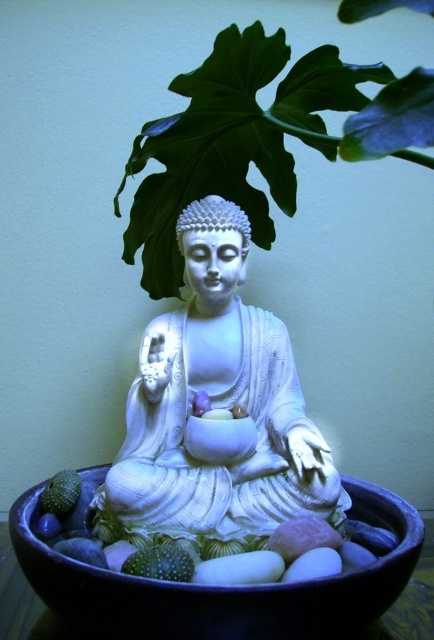
Does black ceramic bowl at center appear on the left side of green speckled fruit at lower center?

In fact, black ceramic bowl at center is to the right of green speckled fruit at lower center.

Looking at this image, is black ceramic bowl at center above green speckled fruit at lower center?

No.

Image resolution: width=434 pixels, height=640 pixels. I want to click on black ceramic bowl at center, so click(222, 588).

Is point (122, 564) less distant than point (66, 477)?

Yes, point (122, 564) is closer to viewer.

Can you confirm if green speckled fruit at lower center is positioned to the right of green matte avocado at lower left?

Indeed, green speckled fruit at lower center is positioned on the right side of green matte avocado at lower left.

This screenshot has height=640, width=434. What do you see at coordinates (161, 563) in the screenshot?
I see `green speckled fruit at lower center` at bounding box center [161, 563].

The image size is (434, 640). In order to click on green speckled fruit at lower center in this screenshot , I will do `click(161, 563)`.

Can you confirm if black ceramic bowl at center is taller than green matte avocado at lower left?

Yes.

Which is in front, point (200, 589) or point (51, 506)?

Point (200, 589)

At what (x,y) coordinates should I click in order to perform the action: click on black ceramic bowl at center. Please return your answer as a coordinate pair (x, y). This screenshot has height=640, width=434. Looking at the image, I should click on (222, 588).